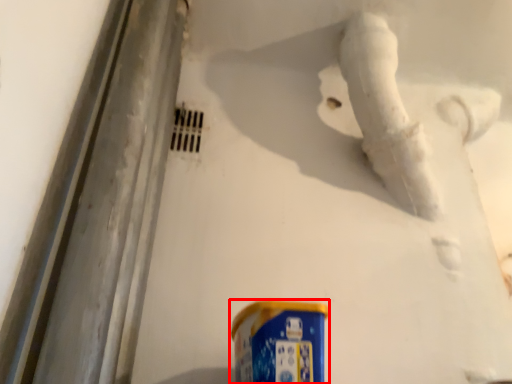
Question: From the image's perspective, what is the correct spatial positioning of spray can (annotated by the red box) in reference to water pipe?

Choices:
 (A) below
 (B) above

Answer: (A)